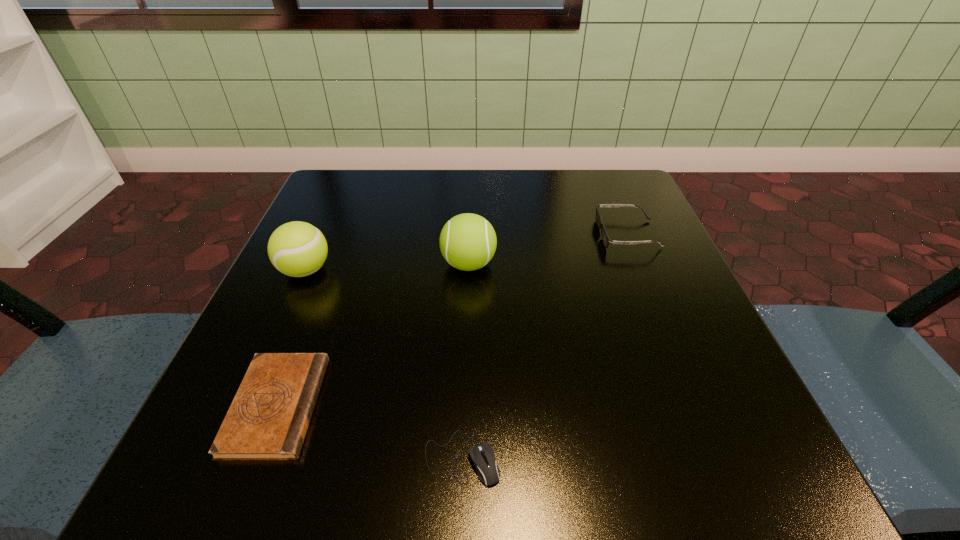
The width and height of the screenshot is (960, 540). What are the coordinates of `free spot between the right tennis ball and the sunglasses` in the screenshot? It's located at (548, 249).

Where is `vacant space that's between the left tennis ball and the right tennis ball`? vacant space that's between the left tennis ball and the right tennis ball is located at coordinates (387, 267).

The height and width of the screenshot is (540, 960). I want to click on vacant region between the left tennis ball and the diary, so click(291, 338).

At what (x,y) coordinates should I click in order to perform the action: click on free space between the rightmost object and the computer mouse. Please return your answer as a coordinate pair (x, y). Looking at the image, I should click on (544, 346).

Where is `free spot between the right tennis ball and the left tennis ball`? Image resolution: width=960 pixels, height=540 pixels. free spot between the right tennis ball and the left tennis ball is located at coordinates (387, 267).

Where is `free space between the diary and the right tennis ball`? This screenshot has height=540, width=960. free space between the diary and the right tennis ball is located at coordinates (372, 335).

At what (x,y) coordinates should I click in order to perform the action: click on vacant space that is in between the computer mouse and the left tennis ball. Please return your answer as a coordinate pair (x, y). Image resolution: width=960 pixels, height=540 pixels. Looking at the image, I should click on (384, 364).

In order to click on vacant area that lies between the right tennis ball and the diary in this screenshot , I will do `click(372, 335)`.

Locate an element on the screen. the closest object relative to the diary is located at coordinates (482, 455).

Choose which object is the second nearest neighbor to the left tennis ball. Please provide its 2D coordinates. Your answer should be formatted as a tuple, i.e. [(x, y)], where the tuple contains the x and y coordinates of a point satisfying the conditions above.

[(468, 242)]